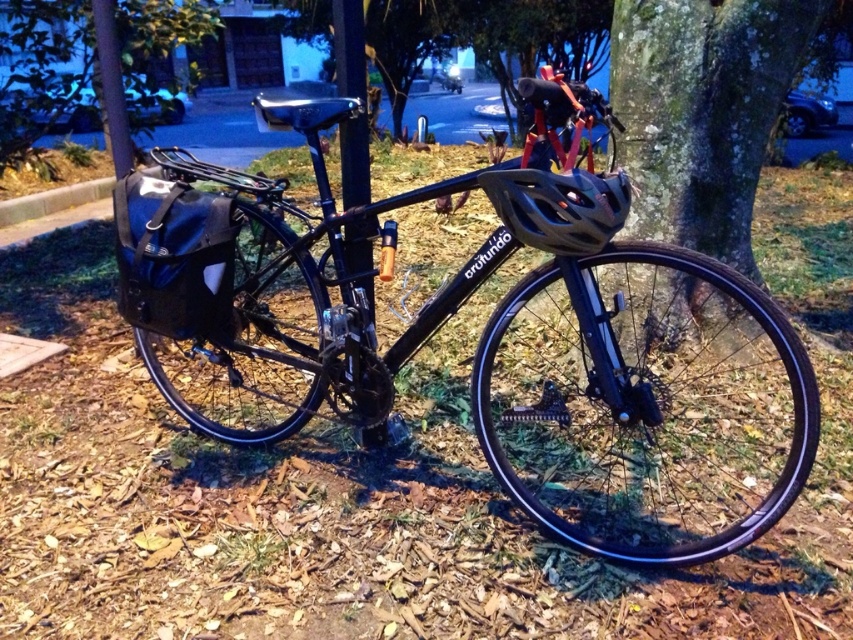
Question: Is matte black helmet at center to the left of black matte pole at center from the viewer's perspective?

Choices:
 (A) no
 (B) yes

Answer: (A)

Question: Which point is farther to the camera?

Choices:
 (A) (41, 106)
 (B) (248, 241)
 (C) (573, 157)

Answer: (A)

Question: Can you confirm if black matte bicycle at center is smaller than matte black helmet at center?

Choices:
 (A) no
 (B) yes

Answer: (A)

Question: In this image, where is black matte bicycle at center located relative to green leafy tree at center?

Choices:
 (A) left
 (B) right

Answer: (B)

Question: Estimate the real-world distances between objects in this image. Which object is closer to the matte black helmet at upper center?

Choices:
 (A) metallic pole at upper center
 (B) green mossy bark at center

Answer: (B)

Question: Which of the following is the farthest from the observer?

Choices:
 (A) (115, 81)
 (B) (24, 150)

Answer: (B)